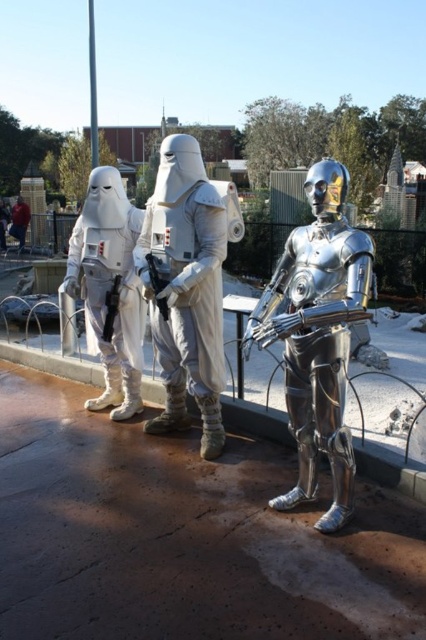
Question: Considering the real-world distances, which object is closest to the white matte armor at center?

Choices:
 (A) white matte/soft fabric at center
 (B) shiny metallic robot at center

Answer: (B)

Question: Which point is closer to the camera?

Choices:
 (A) (348, 429)
 (B) (17, 205)
 (C) (206, 424)
 (D) (129, 301)

Answer: (A)

Question: Is white matte armor at center positioned at the back of white matte stormtrooper at left?

Choices:
 (A) yes
 (B) no

Answer: (B)

Question: Does white matte armor at center have a lesser width compared to white matte/soft fabric at center?

Choices:
 (A) no
 (B) yes

Answer: (A)

Question: Among these points, which one is nearest to the camera?

Choices:
 (A) (19, 236)
 (B) (193, 369)

Answer: (B)

Question: Is shiny metallic robot at center bigger than white matte armor at center?

Choices:
 (A) yes
 (B) no

Answer: (B)